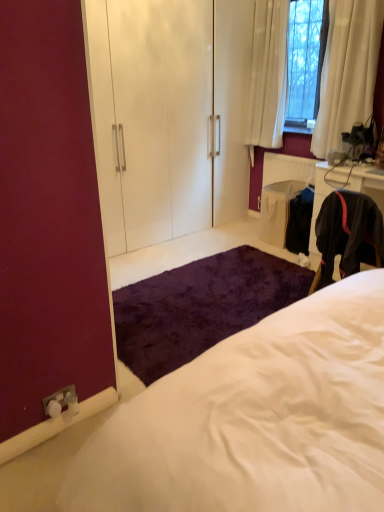
Question: From the image's perspective, is white glossy armoire at upper center beneath shaggy purple rug at lower center?

Choices:
 (A) no
 (B) yes

Answer: (A)

Question: Could shaggy purple rug at lower center be considered to be inside white glossy armoire at upper center?

Choices:
 (A) yes
 (B) no

Answer: (B)

Question: Does white glossy armoire at upper center lie behind shaggy purple rug at lower center?

Choices:
 (A) yes
 (B) no

Answer: (A)

Question: Does white glossy armoire at upper center have a greater height compared to shaggy purple rug at lower center?

Choices:
 (A) no
 (B) yes

Answer: (B)

Question: Can you confirm if white glossy armoire at upper center is shorter than shaggy purple rug at lower center?

Choices:
 (A) yes
 (B) no

Answer: (B)

Question: Is white fluffy bed at center in front of or behind white glossy armoire at upper center in the image?

Choices:
 (A) front
 (B) behind

Answer: (A)

Question: From a real-world perspective, relative to white glossy armoire at upper center, is white fluffy bed at center vertically above or below?

Choices:
 (A) above
 (B) below

Answer: (B)

Question: Would you say white fluffy bed at center is inside or outside white glossy armoire at upper center?

Choices:
 (A) inside
 (B) outside

Answer: (B)

Question: In the image, is white fluffy bed at center on the left side or the right side of white glossy armoire at upper center?

Choices:
 (A) left
 (B) right

Answer: (B)

Question: Based on their sizes in the image, would you say white fluffy bed at center is bigger or smaller than shaggy purple rug at lower center?

Choices:
 (A) small
 (B) big

Answer: (B)

Question: Do you think white fluffy bed at center is within shaggy purple rug at lower center, or outside of it?

Choices:
 (A) outside
 (B) inside

Answer: (A)

Question: From the image's perspective, relative to shaggy purple rug at lower center, is white fluffy bed at center above or below?

Choices:
 (A) below
 (B) above

Answer: (A)

Question: Considering the positions of point (145, 497) and point (228, 271), is point (145, 497) closer or farther from the camera than point (228, 271)?

Choices:
 (A) farther
 (B) closer

Answer: (B)

Question: Visually, is white glossy armoire at upper center positioned to the left or to the right of shaggy purple rug at lower center?

Choices:
 (A) right
 (B) left

Answer: (B)

Question: Considering their positions, is white glossy armoire at upper center located in front of or behind shaggy purple rug at lower center?

Choices:
 (A) behind
 (B) front

Answer: (A)